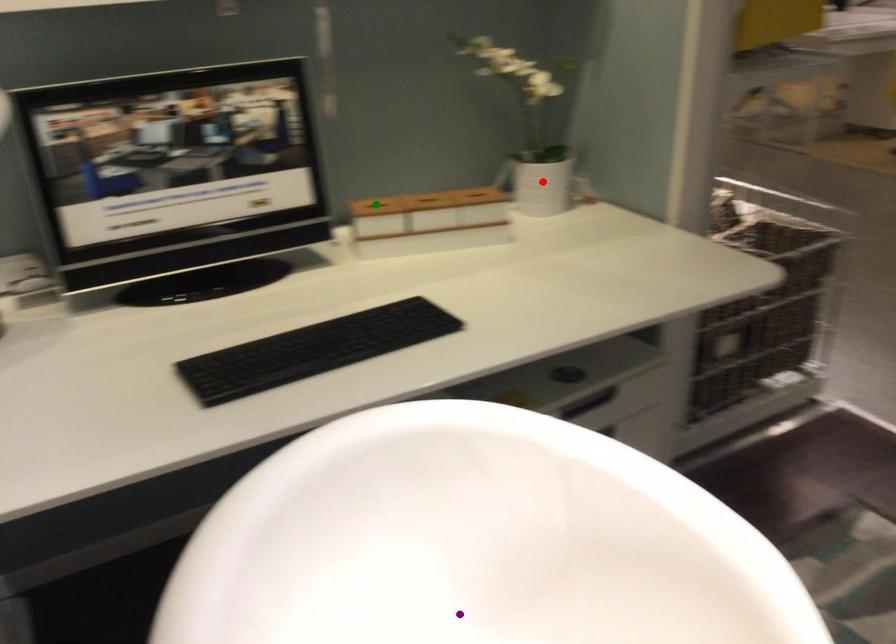
Looking at this image, order these from farthest to nearest:
red point, purple point, green point

red point
green point
purple point